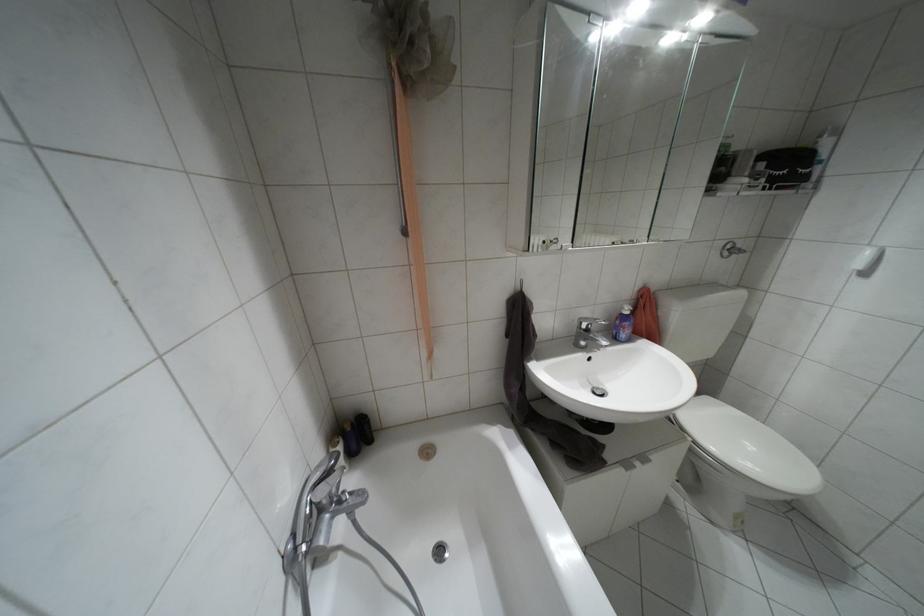
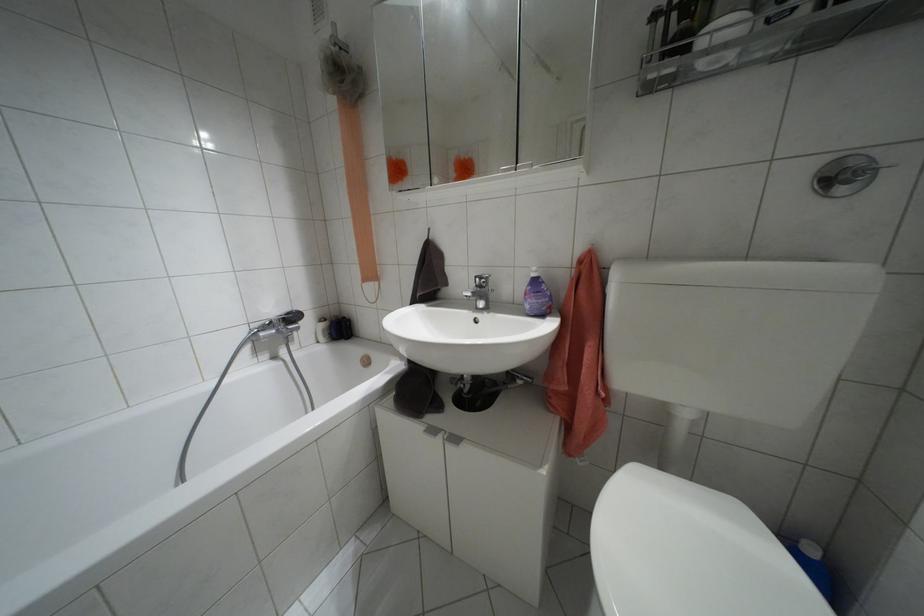
The point at [626,312] is marked in the first image. Where is the corresponding point in the second image?

(532, 274)